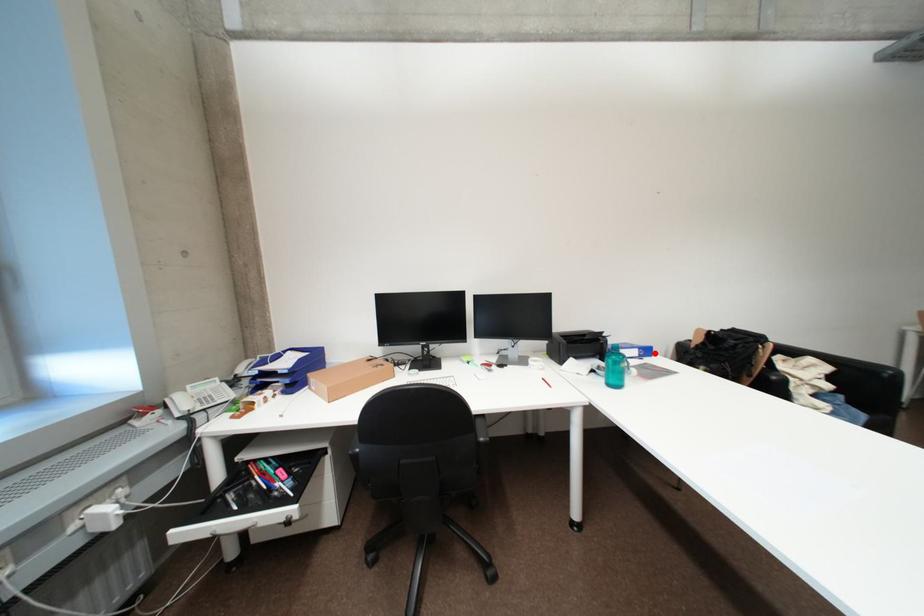
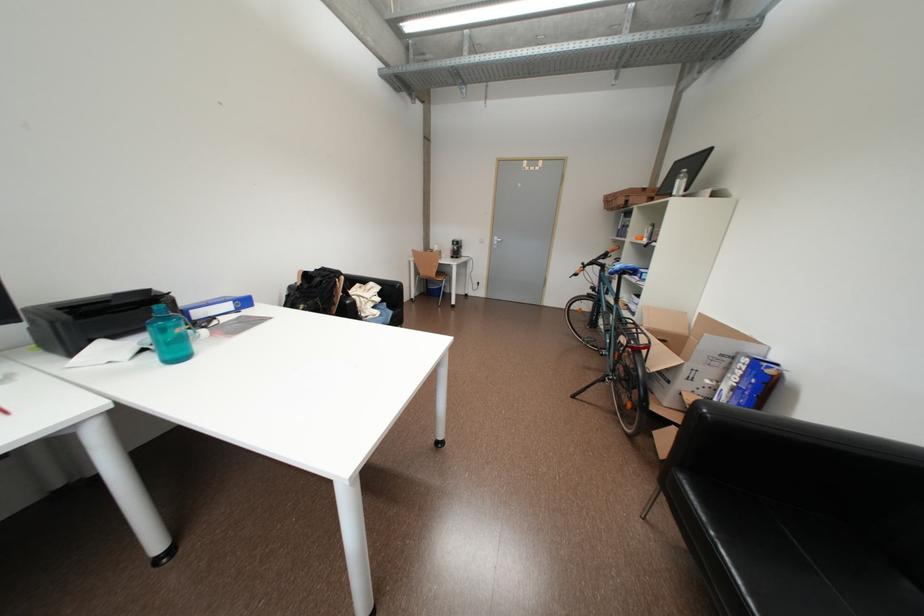
Where in the second image is the point corresponding to the highlighted location from the first image?

(252, 304)